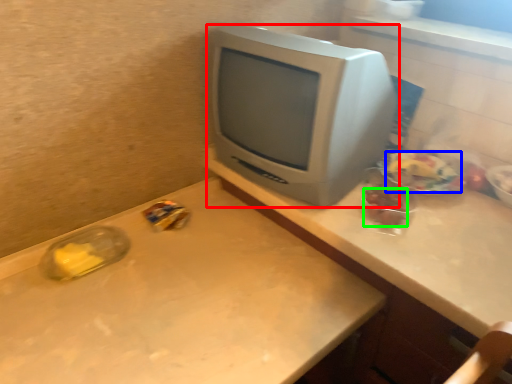
Question: Which object is the closest to the computer monitor (highlighted by a red box)? Choose among these: food (highlighted by a blue box) or food (highlighted by a green box).

Choices:
 (A) food
 (B) food

Answer: (B)